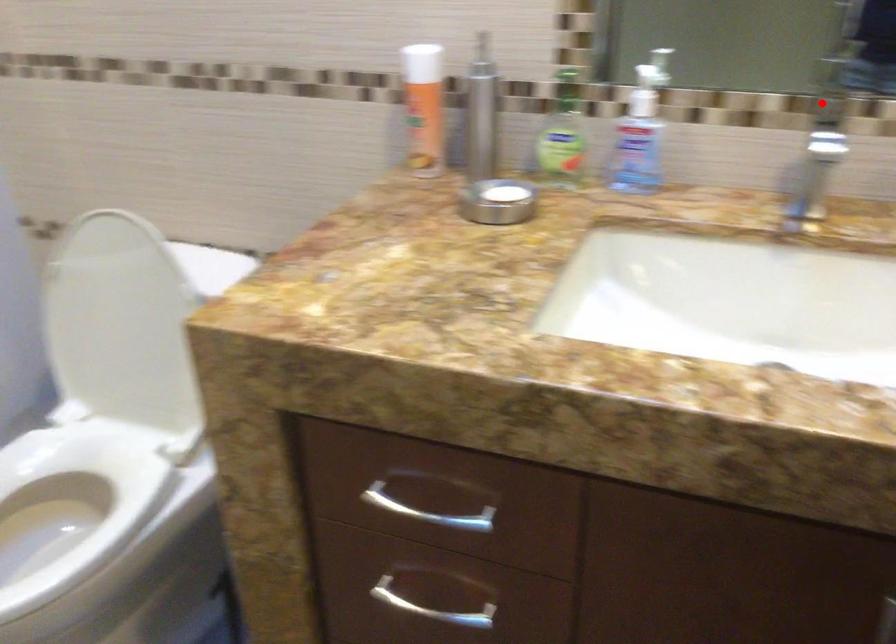
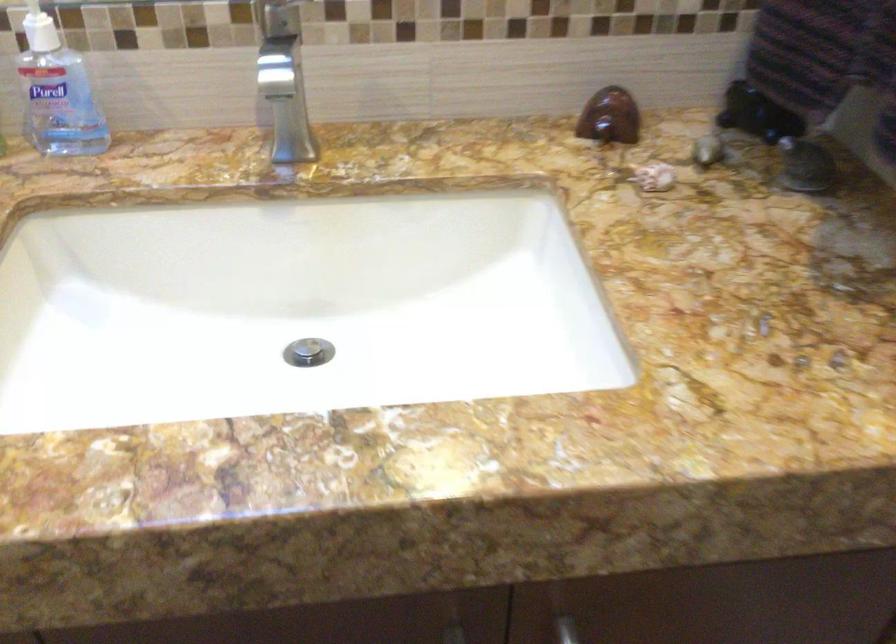
Question: I am providing you with two images of the same scene from different viewpoints. In image1, a red point is highlighted. Considering the same 3D point in image2, which of the following is correct?

Choices:
 (A) It is closer
 (B) It is farther

Answer: (A)